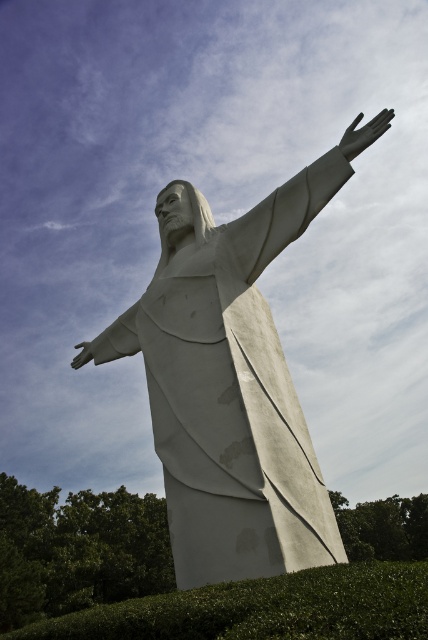
Question: Does white marble statue at center appear over green leafy hedge at lower center?

Choices:
 (A) no
 (B) yes

Answer: (B)

Question: Can you confirm if white marble statue at center is positioned to the right of green leafy hedge at lower center?

Choices:
 (A) no
 (B) yes

Answer: (A)

Question: Is white marble statue at center closer to camera compared to green leafy hedge at lower center?

Choices:
 (A) yes
 (B) no

Answer: (B)

Question: Which point appears closest to the camera in this image?

Choices:
 (A) pos(139,595)
 (B) pos(315,204)

Answer: (B)